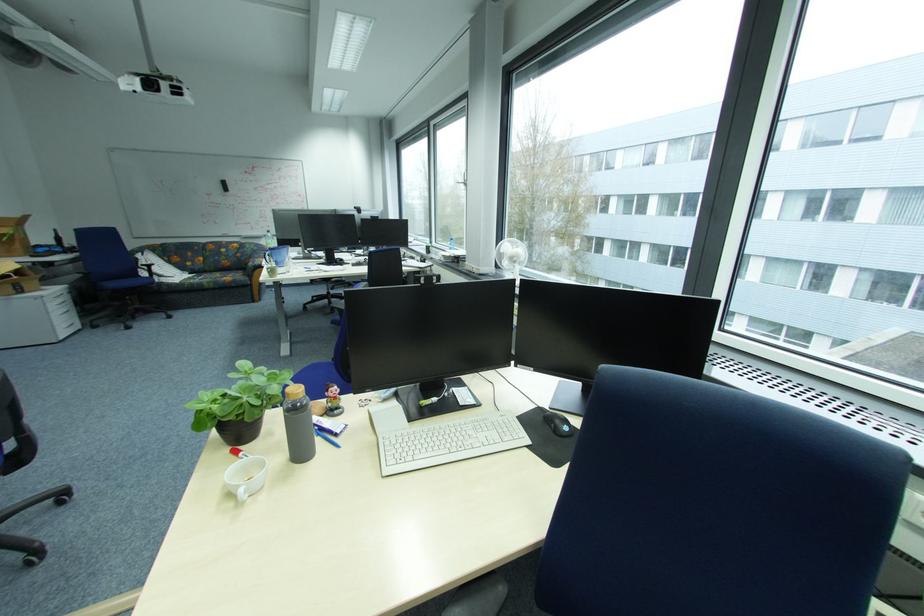
This screenshot has width=924, height=616. Describe the element at coordinates (126, 283) in the screenshot. I see `a blue chair sitting surface` at that location.